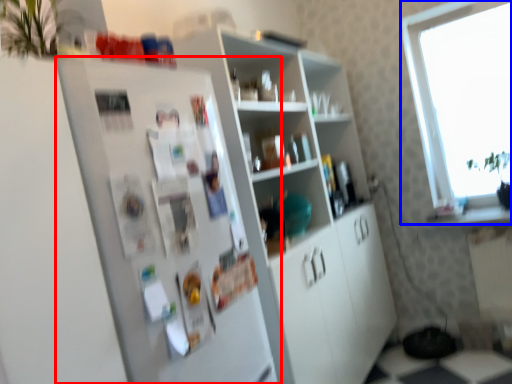
Question: Which point is further to the camera, fridge (highlighted by a red box) or window (highlighted by a blue box)?

Choices:
 (A) fridge
 (B) window

Answer: (B)